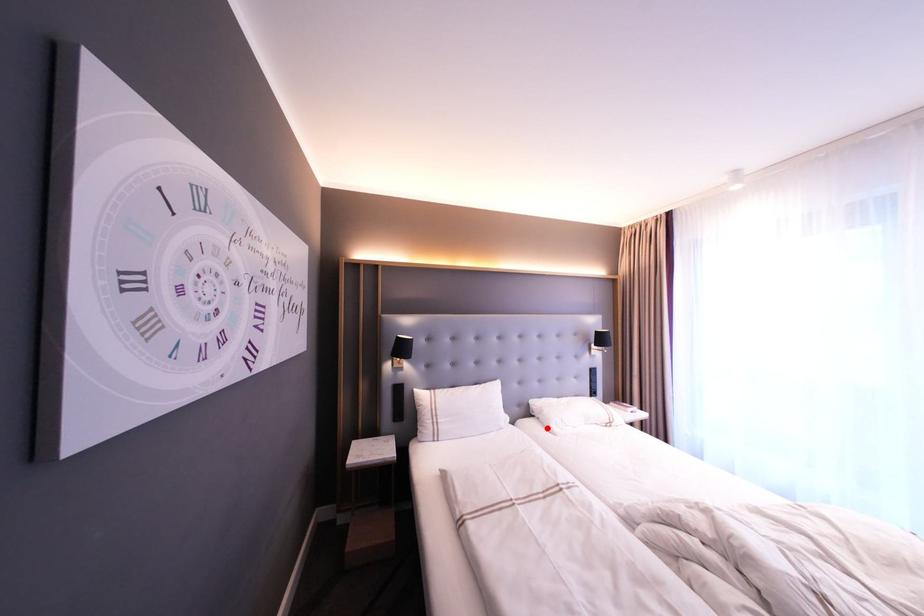
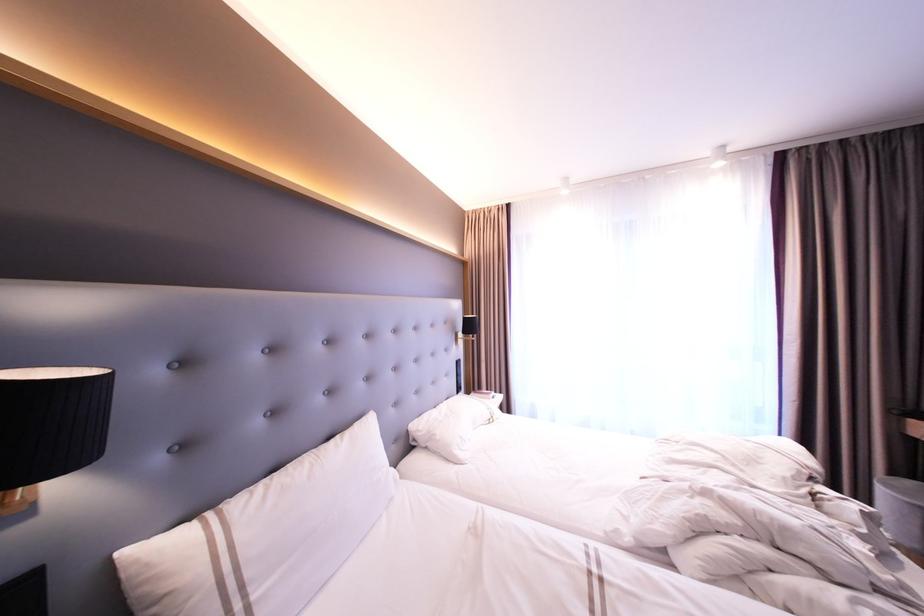
The point at the highlighted location is marked in the first image. Where is the corresponding point in the second image?

(447, 460)